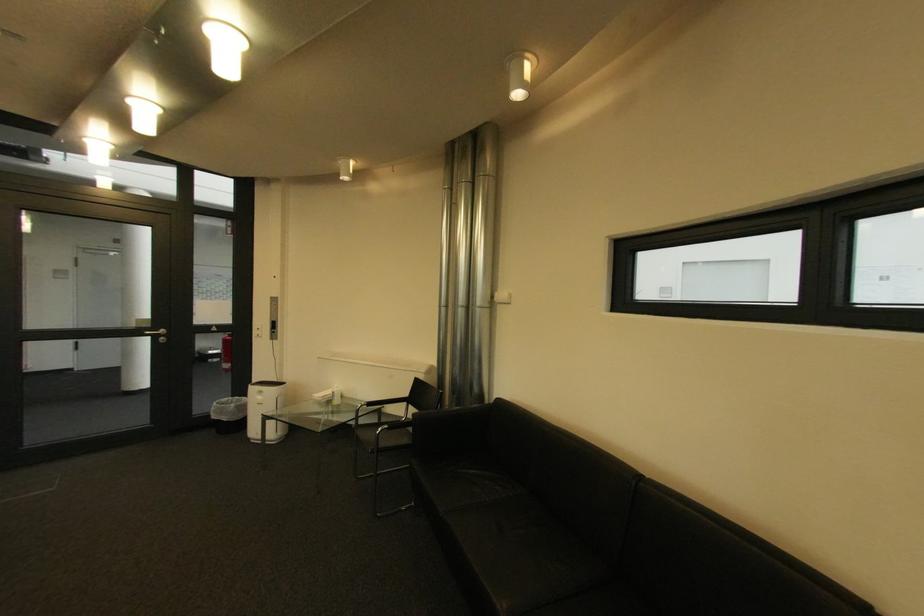
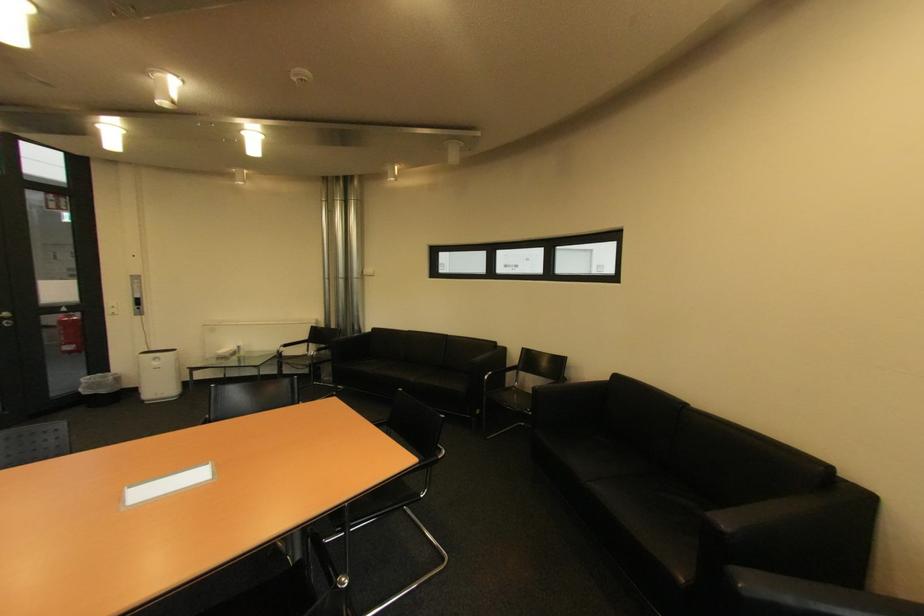
Locate, in the second image, the point that corresponds to point 280,305 in the first image.

(140, 283)